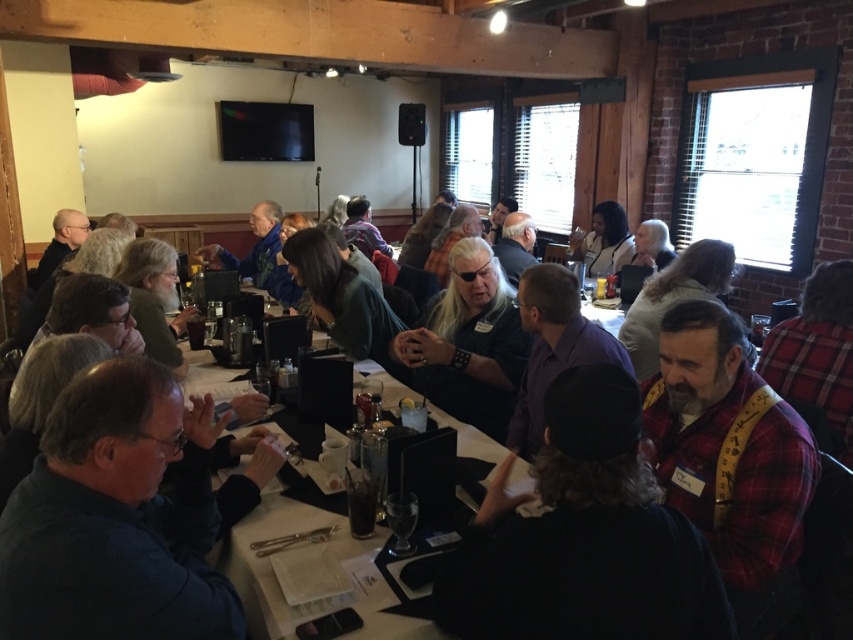
Question: Which is nearer to the red plaid shirt at right?

Choices:
 (A) dark blue shirt at lower left
 (B) flannel shirt at center
 (C) matte black jacket at center

Answer: (B)

Question: Is white glossy table at center bigger than matte black jacket at center?

Choices:
 (A) yes
 (B) no

Answer: (A)

Question: Estimate the real-world distances between objects in this image. Which object is farther from the white glossy table at center?

Choices:
 (A) flannel shirt at center
 (B) red plaid shirt at right

Answer: (B)

Question: Which object is the closest to the white glossy table at center?

Choices:
 (A) flannel shirt at center
 (B) plaid flannel shirt at right

Answer: (A)

Question: Is white glossy table at center wider than purple shirt at center?

Choices:
 (A) no
 (B) yes

Answer: (B)

Question: Does white glossy table at center have a smaller size compared to plaid flannel shirt at right?

Choices:
 (A) no
 (B) yes

Answer: (A)